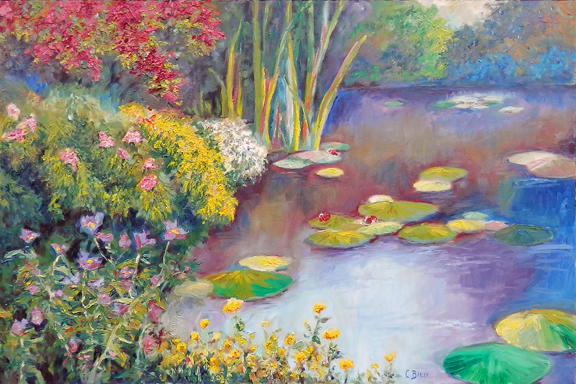
The height and width of the screenshot is (384, 576). In order to click on painting in this screenshot , I will do `click(237, 205)`.